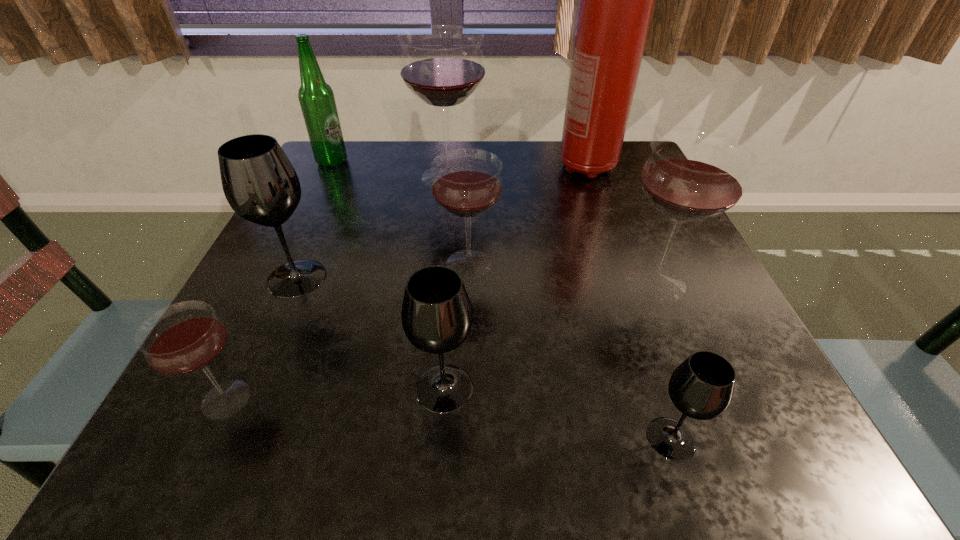
This screenshot has width=960, height=540. In order to click on the second gray wineglass from left to right in this screenshot , I will do `click(436, 314)`.

The height and width of the screenshot is (540, 960). Find the location of `the nearest red wineglass`. the nearest red wineglass is located at coordinates (184, 338).

Find the location of a particular element. the leftmost red wineglass is located at coordinates (184, 338).

The image size is (960, 540). What are the coordinates of `the smallest gray wineglass` in the screenshot? It's located at (701, 387).

The width and height of the screenshot is (960, 540). I want to click on the rightmost gray wineglass, so click(701, 387).

Where is `vacant position located 0.370m on the handle side the fire extinguisher`? Image resolution: width=960 pixels, height=540 pixels. vacant position located 0.370m on the handle side the fire extinguisher is located at coordinates (636, 307).

Image resolution: width=960 pixels, height=540 pixels. I want to click on free space located on the front of the farthest red wineglass, so click(442, 241).

You are a GUI agent. You are given a task and a screenshot of the screen. Output one action in this format:
    pyautogui.click(x=<x>, y=<y>)
    Task: Click on the free space located 0.340m on the label of the green beer bottle
    
    Given the screenshot: What is the action you would take?
    pyautogui.click(x=484, y=161)

Where is `free spot located on the back of the rightmost red wineglass`? The image size is (960, 540). free spot located on the back of the rightmost red wineglass is located at coordinates (604, 158).

The height and width of the screenshot is (540, 960). Identify the location of vacant region located 0.380m on the back of the biggest gray wineglass. (349, 160).